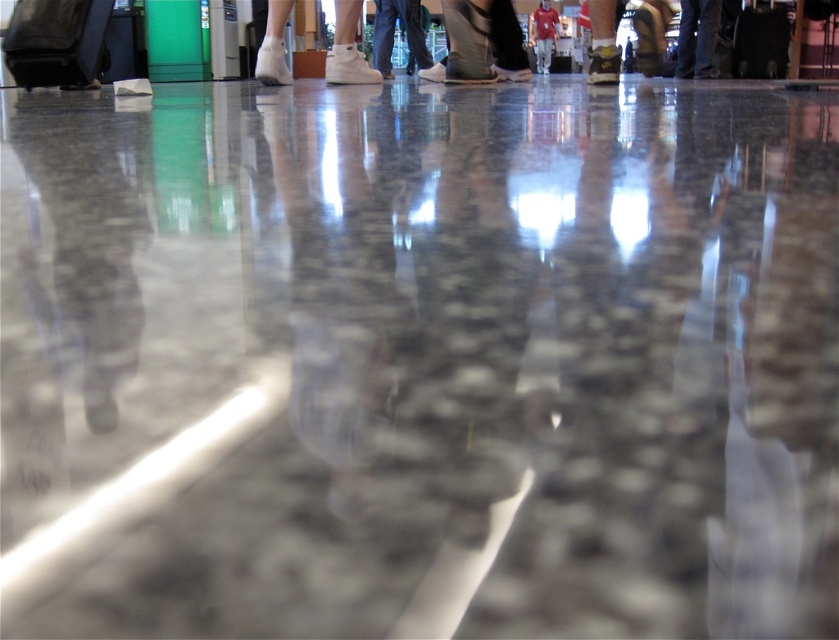
Question: Considering the real-world distances, which object is farthest from the matte red shirt at center?

Choices:
 (A) black leather suitcase at center
 (B) matte black suitcase at center
 (C) black matte suitcase at upper left

Answer: (C)

Question: Considering the relative positions of black matte suitcase at upper left and black leather suitcase at center in the image provided, where is black matte suitcase at upper left located with respect to black leather suitcase at center?

Choices:
 (A) right
 (B) left

Answer: (B)

Question: Does black matte suitcase at upper left have a smaller size compared to matte red shirt at center?

Choices:
 (A) no
 (B) yes

Answer: (A)

Question: Is black matte suitcase at upper left to the left of denim pants at center from the viewer's perspective?

Choices:
 (A) yes
 (B) no

Answer: (A)

Question: Which object is positioned farthest from the black leather suitcase at center?

Choices:
 (A) matte red shirt at center
 (B) black matte suitcase at upper left

Answer: (B)

Question: Which of the following is the closest to the observer?

Choices:
 (A) (379, 38)
 (B) (61, 81)
 (C) (561, 51)

Answer: (B)